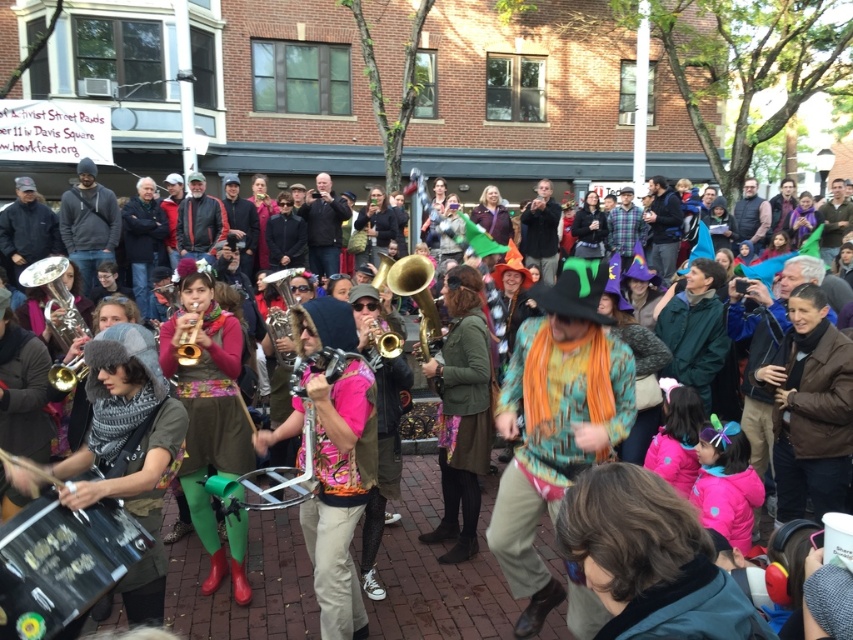
Can you confirm if shiny brass trombone at center is positioned above gold brass trumpet at center?

Yes, shiny brass trombone at center is above gold brass trumpet at center.

Who is more forward, (283,332) or (190,324)?

Point (190,324)

Which is behind, point (286, 285) or point (181, 356)?

The point (286, 285) is more distant.

Locate an element on the screen. shiny brass trombone at center is located at coordinates click(281, 316).

Which of these two, metallic brass instruments at center or shiny silver trumpet at left, stands shorter?

Standing shorter between the two is metallic brass instruments at center.

Looking at this image, is metallic brass instruments at center smaller than shiny silver trumpet at left?

Actually, metallic brass instruments at center might be larger than shiny silver trumpet at left.

This screenshot has width=853, height=640. Describe the element at coordinates (436, 568) in the screenshot. I see `metallic brass instruments at center` at that location.

Find the location of a particular element. metallic brass instruments at center is located at coordinates (436, 568).

Is point (407, 285) farther from viewer compared to point (187, 364)?

Yes, point (407, 285) is behind point (187, 364).

Between point (434, 320) and point (190, 332), which one is positioned behind?

Point (434, 320)

This screenshot has height=640, width=853. Identify the location of brass saxophone at center. (416, 298).